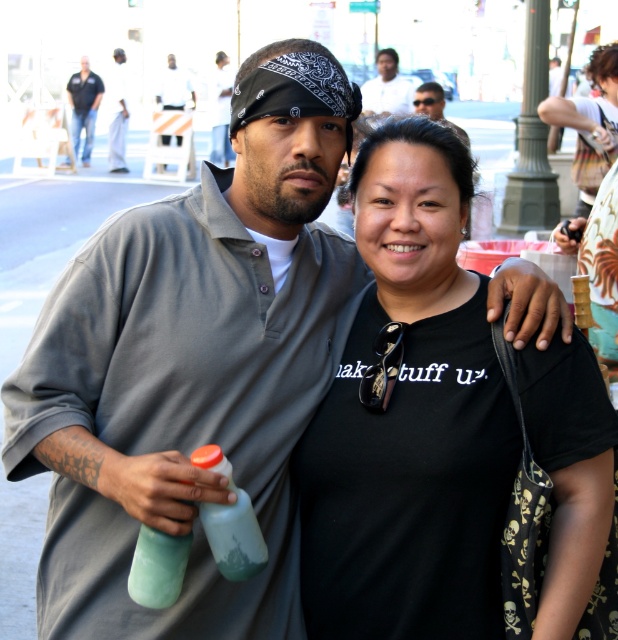
Question: Can you confirm if dark blue shirt at center is positioned above matte gray shirt at center?

Choices:
 (A) no
 (B) yes

Answer: (A)

Question: Estimate the real-world distances between objects in this image. Which object is closer to the matte black bandana at center?

Choices:
 (A) smooth white shirt at upper center
 (B) white cotton shirt at upper center
 (C) matte gray shirt at center

Answer: (C)

Question: Which of the following is the closest to the observer?

Choices:
 (A) (455, 157)
 (B) (98, 92)
 (C) (216, 81)
 (D) (167, 83)

Answer: (A)

Question: Is the position of dark blue shirt at center less distant than that of matte black bandana at center?

Choices:
 (A) no
 (B) yes

Answer: (A)

Question: Is smooth white shirt at upper center thinner than matte black bandana at center?

Choices:
 (A) yes
 (B) no

Answer: (A)

Question: Which point is farther to the camera?

Choices:
 (A) (371, 104)
 (B) (78, 86)
 (C) (243, 572)
 (D) (119, 100)

Answer: (D)